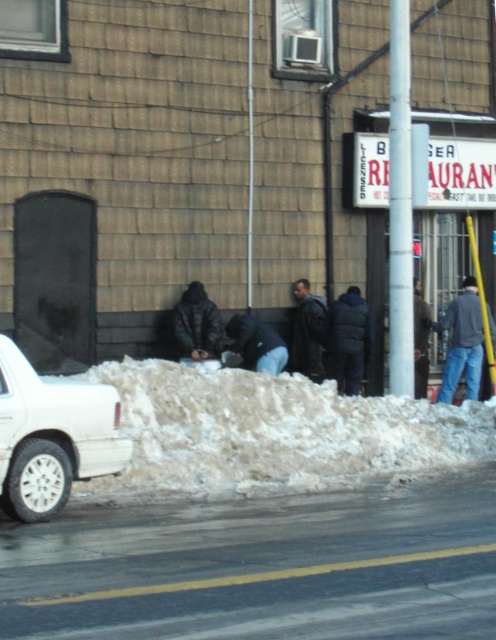
Who is higher up, white fluffy snow at lower center or white matte car at lower left?

white matte car at lower left is higher up.

Which is behind, point (385, 452) or point (42, 468)?

Point (385, 452)

Between point (410, 410) and point (63, 499), which one is positioned in front?

Point (63, 499) is more forward.

Where is `white fluffy snow at lower center`? This screenshot has width=496, height=640. white fluffy snow at lower center is located at coordinates (273, 433).

Between white matte car at lower left and dark blue jeans at right, which one appears on the left side from the viewer's perspective?

white matte car at lower left is more to the left.

Is white matte car at lower left above dark blue jeans at right?

Actually, white matte car at lower left is below dark blue jeans at right.

You are a GUI agent. You are given a task and a screenshot of the screen. Output one action in this format:
    pyautogui.click(x=<x>, y=<y>)
    Task: Click on the white matte car at lower left
    
    Given the screenshot: What is the action you would take?
    pyautogui.click(x=53, y=436)

Where is `white matte car at lower left`? This screenshot has width=496, height=640. white matte car at lower left is located at coordinates (53, 436).

What do you see at coordinates (273, 433) in the screenshot? I see `white fluffy snow at lower center` at bounding box center [273, 433].

Does white fluffy snow at lower center have a greater width compared to dark gray jacket at center?

Indeed, white fluffy snow at lower center has a greater width compared to dark gray jacket at center.

Does point (389, 428) lie in front of point (303, 336)?

Yes, point (389, 428) is in front of point (303, 336).

Locate an element on the screen. white fluffy snow at lower center is located at coordinates (273, 433).